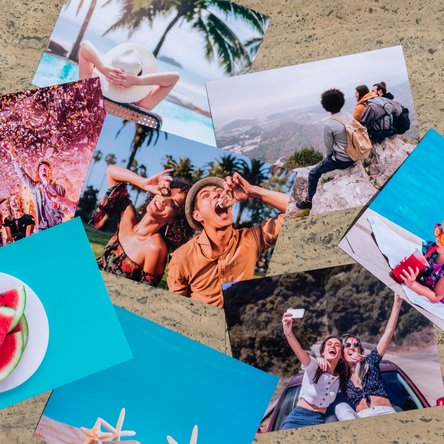
Where is `pictures`? The width and height of the screenshot is (444, 444). pictures is located at coordinates (147, 26), (67, 103), (182, 148), (307, 95), (414, 255), (348, 328), (201, 379), (55, 327).